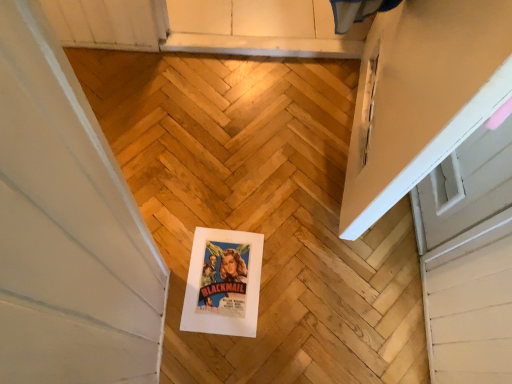
Image resolution: width=512 pixels, height=384 pixels. What do you see at coordinates (223, 283) in the screenshot?
I see `matte paper poster at center` at bounding box center [223, 283].

I want to click on matte paper poster at center, so click(223, 283).

I want to click on matte paper poster at center, so click(x=223, y=283).